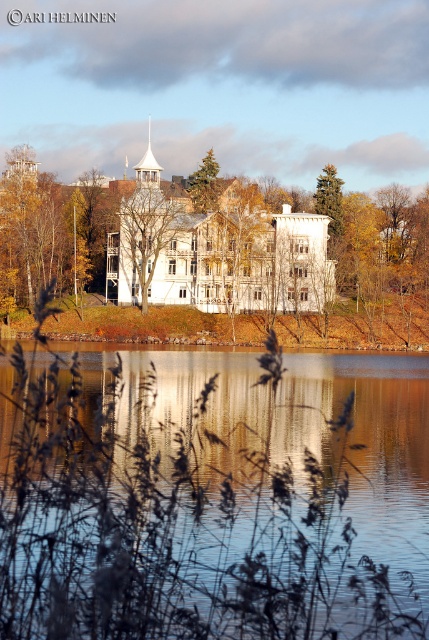
You are a landscape architect planning to install a pathway between the green matte tree at upper center and the green textured tree at upper center. Given that the pathway requires a minimum of 10 meters of space, will there be enough room for it?

The distance between the green matte tree at upper center and the green textured tree at upper center is 15.44 meters, which exceeds the required 10 meters. Therefore, there is sufficient space to install the pathway.